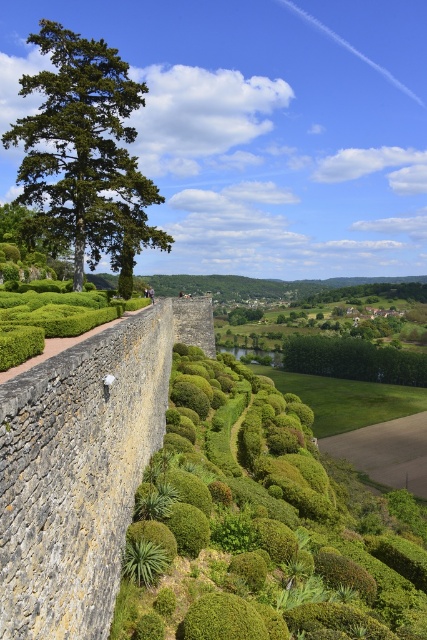
Question: Does green leafy hedge at center have a smaller size compared to green leafy tree at upper left?

Choices:
 (A) no
 (B) yes

Answer: (A)

Question: Among these objects, which one is farthest from the camera?

Choices:
 (A) green leafy hedge at center
 (B) green leafy tree at upper left

Answer: (B)

Question: Is green leafy hedge at center to the left of green leafy tree at upper left from the viewer's perspective?

Choices:
 (A) yes
 (B) no

Answer: (B)

Question: Which of the following is the closest to the observer?

Choices:
 (A) green leafy hedge at center
 (B) green leafy tree at upper left

Answer: (A)

Question: Is green leafy hedge at center further to camera compared to green leafy tree at upper left?

Choices:
 (A) no
 (B) yes

Answer: (A)